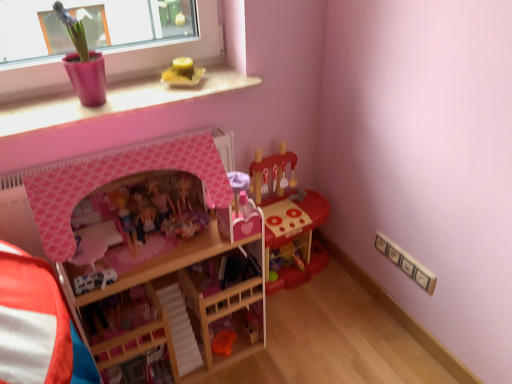
What do you see at coordinates (83, 63) in the screenshot?
I see `matte pink pot at upper left, the 1th toy in the left-to-right sequence` at bounding box center [83, 63].

This screenshot has height=384, width=512. I want to click on matte plastic play kitchen at center, which is the 1th toy from right to left, so tap(288, 219).

What is the approximate height of matte plastic play kitchen at center, which is the 1th toy from right to left?

matte plastic play kitchen at center, which is the 1th toy from right to left, is 24.77 inches in height.

What do you see at coordinates (161, 210) in the screenshot? This screenshot has height=384, width=512. I see `pink matte dollhouse at center, which is the 3th toy in left-to-right order` at bounding box center [161, 210].

The height and width of the screenshot is (384, 512). I want to click on white plastic car at center, the 2th toy in the left-to-right sequence, so click(x=94, y=280).

Measure the distance between point (48, 118) and camera.

The depth of point (48, 118) is 1.34 meters.

Where is `pink plastic window sill at upper left`? pink plastic window sill at upper left is located at coordinates (115, 101).

Where is `matte pink pot at upper left, the 1th toy in the left-to-right sequence`? matte pink pot at upper left, the 1th toy in the left-to-right sequence is located at coordinates (83, 63).

From the image's perspective, which object appears higher, pink matte dollhouse at center, which is the 3th toy from right to left, or white plastic car at center, the fourth toy positioned from the right?

From the image's view, pink matte dollhouse at center, which is the 3th toy from right to left, is above.

Is pink matte dollhouse at center, which is the 3th toy in left-to-right order, far from white plastic car at center, the fourth toy positioned from the right?

No, pink matte dollhouse at center, which is the 3th toy in left-to-right order, is not far from white plastic car at center, the fourth toy positioned from the right.

From a real-world perspective, is pink matte dollhouse at center, which is the 3th toy in left-to-right order, physically above white plastic car at center, the fourth toy positioned from the right?

Correct, in the physical world, pink matte dollhouse at center, which is the 3th toy in left-to-right order, is higher than white plastic car at center, the fourth toy positioned from the right.

Does pink matte dollhouse at center, which is the 3th toy in left-to-right order, come behind matte plastic play kitchen at center, which is the 1th toy from right to left?

No, it is in front of matte plastic play kitchen at center, which is the 1th toy from right to left.

Could you tell me if pink matte dollhouse at center, which is the 3th toy in left-to-right order, is turned towards matte plastic play kitchen at center, marked as the 5th toy in a left-to-right arrangement?

No, pink matte dollhouse at center, which is the 3th toy in left-to-right order, is not facing towards matte plastic play kitchen at center, marked as the 5th toy in a left-to-right arrangement.

How distant is white plastic car at center, the 2th toy in the left-to-right sequence, from yellow wax candle at upper center, the fourth toy from the left?

white plastic car at center, the 2th toy in the left-to-right sequence, is 29.58 inches away from yellow wax candle at upper center, the fourth toy from the left.

Is white plastic car at center, the 2th toy in the left-to-right sequence, in contact with yellow wax candle at upper center, positioned as the 2th toy in right-to-left order?

No, white plastic car at center, the 2th toy in the left-to-right sequence, is not next to yellow wax candle at upper center, positioned as the 2th toy in right-to-left order.

Based on the photo, is yellow wax candle at upper center, positioned as the 2th toy in right-to-left order, located within white plastic car at center, the fourth toy positioned from the right?

Definitely not — yellow wax candle at upper center, positioned as the 2th toy in right-to-left order, is not inside white plastic car at center, the fourth toy positioned from the right.

Which object is positioned more to the right, white plastic car at center, the 2th toy in the left-to-right sequence, or yellow wax candle at upper center, the fourth toy from the left?

yellow wax candle at upper center, the fourth toy from the left.

Considering the relative sizes of yellow wax candle at upper center, positioned as the 2th toy in right-to-left order, and wooden bunk bed at center in the image provided, is yellow wax candle at upper center, positioned as the 2th toy in right-to-left order, taller than wooden bunk bed at center?

No, yellow wax candle at upper center, positioned as the 2th toy in right-to-left order, is not taller than wooden bunk bed at center.

Locate an element on the screen. This screenshot has width=512, height=384. bunk bed that appears below the yellow wax candle at upper center, the fourth toy from the left (from the image's perspective) is located at coordinates coord(117,179).

Is point (174, 76) in front of point (77, 319)?

No, it is behind (77, 319).

Is yellow wax candle at upper center, positioned as the 2th toy in right-to-left order, in contact with wooden bunk bed at center?

No, yellow wax candle at upper center, positioned as the 2th toy in right-to-left order, is not in contact with wooden bunk bed at center.

Is wooden bunk bed at center oriented away from white plastic car at center, the 2th toy in the left-to-right sequence?

Yes.

From the image's perspective, between wooden bunk bed at center and white plastic car at center, the 2th toy in the left-to-right sequence, which one is located above?

white plastic car at center, the 2th toy in the left-to-right sequence, appears higher in the image.

Which is more to the left, wooden bunk bed at center or white plastic car at center, the fourth toy positioned from the right?

white plastic car at center, the fourth toy positioned from the right, is more to the left.

Based on the photo, would you say wooden bunk bed at center is a long distance from white plastic car at center, the fourth toy positioned from the right?

Actually, wooden bunk bed at center and white plastic car at center, the fourth toy positioned from the right, are a little close together.

Between matte pink pot at upper left, the 1th toy in the left-to-right sequence, and yellow wax candle at upper center, positioned as the 2th toy in right-to-left order, which one appears on the left side from the viewer's perspective?

matte pink pot at upper left, the 1th toy in the left-to-right sequence.

Is point (85, 63) closer or farther from the camera than point (174, 59)?

Point (85, 63).

Considering the sizes of objects matte pink pot at upper left, arranged as the 5th toy when viewed from the right, and yellow wax candle at upper center, positioned as the 2th toy in right-to-left order, in the image provided, who is bigger, matte pink pot at upper left, arranged as the 5th toy when viewed from the right, or yellow wax candle at upper center, positioned as the 2th toy in right-to-left order,?

matte pink pot at upper left, arranged as the 5th toy when viewed from the right, is bigger.

Is yellow wax candle at upper center, positioned as the 2th toy in right-to-left order, located within matte pink pot at upper left, the 1th toy in the left-to-right sequence?

That's incorrect, yellow wax candle at upper center, positioned as the 2th toy in right-to-left order, is not inside matte pink pot at upper left, the 1th toy in the left-to-right sequence.

What's the angular difference between pink plastic window sill at upper left and matte pink pot at upper left, arranged as the 5th toy when viewed from the right,'s facing directions?

The angle between the facing direction of pink plastic window sill at upper left and the facing direction of matte pink pot at upper left, arranged as the 5th toy when viewed from the right, is 1.9 degrees.

Does pink plastic window sill at upper left have a larger size compared to matte pink pot at upper left, arranged as the 5th toy when viewed from the right?

Actually, pink plastic window sill at upper left might be smaller than matte pink pot at upper left, arranged as the 5th toy when viewed from the right.

From a real-world perspective, is pink plastic window sill at upper left positioned above or below matte pink pot at upper left, the 1th toy in the left-to-right sequence?

pink plastic window sill at upper left is below matte pink pot at upper left, the 1th toy in the left-to-right sequence.

At what (x,y) coordinates should I click in order to perform the action: click on toy that is the 2nd object located above the pink plastic window sill at upper left (from the image's perspective). Please return your answer as a coordinate pair (x, y). The image size is (512, 384). Looking at the image, I should click on (83, 63).

You are a GUI agent. You are given a task and a screenshot of the screen. Output one action in this format:
    pyautogui.click(x=<x>, y=<y>)
    Task: Click on the 1st toy located above the white plastic car at center, the 2th toy in the left-to-right sequence (from a real-world perspective)
    The height and width of the screenshot is (384, 512).
    Given the screenshot: What is the action you would take?
    pyautogui.click(x=161, y=210)

Starting from the pink matte dollhouse at center, which is the 3th toy in left-to-right order, which toy is the 2nd one behind? Please provide its 2D coordinates.

[(288, 219)]

Based on their spatial positions, is matte pink pot at upper left, arranged as the 5th toy when viewed from the right, or pink plastic window sill at upper left further from matte plastic play kitchen at center, which is the 1th toy from right to left?

matte pink pot at upper left, arranged as the 5th toy when viewed from the right, is further to matte plastic play kitchen at center, which is the 1th toy from right to left.

When comparing their distances from matte pink pot at upper left, the 1th toy in the left-to-right sequence, does matte plastic play kitchen at center, marked as the 5th toy in a left-to-right arrangement, or pink plastic window sill at upper left seem further?

Based on the image, matte plastic play kitchen at center, marked as the 5th toy in a left-to-right arrangement, appears to be further to matte pink pot at upper left, the 1th toy in the left-to-right sequence.

When comparing their distances from yellow wax candle at upper center, the fourth toy from the left, does pink matte dollhouse at center, which is the 3th toy in left-to-right order, or wooden bunk bed at center seem further?

wooden bunk bed at center is positioned further to the anchor yellow wax candle at upper center, the fourth toy from the left.

Looking at the image, which one is located further to pink plastic window sill at upper left, matte plastic play kitchen at center, marked as the 5th toy in a left-to-right arrangement, or wooden bunk bed at center?

matte plastic play kitchen at center, marked as the 5th toy in a left-to-right arrangement.

Looking at the image, which one is located further to yellow wax candle at upper center, positioned as the 2th toy in right-to-left order, pink matte dollhouse at center, which is the 3th toy from right to left, or pink plastic window sill at upper left?

pink matte dollhouse at center, which is the 3th toy from right to left, is further to yellow wax candle at upper center, positioned as the 2th toy in right-to-left order.

From the image, which object appears to be nearer to yellow wax candle at upper center, positioned as the 2th toy in right-to-left order, pink plastic window sill at upper left or matte plastic play kitchen at center, marked as the 5th toy in a left-to-right arrangement?

The object closer to yellow wax candle at upper center, positioned as the 2th toy in right-to-left order, is pink plastic window sill at upper left.

Considering their positions, is yellow wax candle at upper center, positioned as the 2th toy in right-to-left order, positioned further to pink plastic window sill at upper left than pink matte dollhouse at center, which is the 3th toy in left-to-right order?

Based on the image, pink matte dollhouse at center, which is the 3th toy in left-to-right order, appears to be further to pink plastic window sill at upper left.

Based on the photo, estimate the real-world distances between objects in this image. Which object is further from pink plastic window sill at upper left, matte plastic play kitchen at center, which is the 1th toy from right to left, or white plastic car at center, the fourth toy positioned from the right?

white plastic car at center, the fourth toy positioned from the right, is positioned further to the anchor pink plastic window sill at upper left.

I want to click on window sill situated between white plastic car at center, the fourth toy positioned from the right, and matte plastic play kitchen at center, marked as the 5th toy in a left-to-right arrangement, from left to right, so tap(115, 101).

Where is `window sill between matte pink pot at upper left, arranged as the 5th toy when viewed from the right, and white plastic car at center, the fourth toy positioned from the right, from top to bottom`? This screenshot has height=384, width=512. window sill between matte pink pot at upper left, arranged as the 5th toy when viewed from the right, and white plastic car at center, the fourth toy positioned from the right, from top to bottom is located at coordinates (115, 101).

This screenshot has width=512, height=384. What are the coordinates of `toy between yellow wax candle at upper center, the fourth toy from the left, and matte plastic play kitchen at center, marked as the 5th toy in a left-to-right arrangement, vertically` in the screenshot? It's located at (161, 210).

You are a GUI agent. You are given a task and a screenshot of the screen. Output one action in this format:
    pyautogui.click(x=<x>, y=<y>)
    Task: Click on the window sill between yellow wax candle at upper center, positioned as the 2th toy in right-to-left order, and wooden bunk bed at center from top to bottom
    The height and width of the screenshot is (384, 512).
    Given the screenshot: What is the action you would take?
    pyautogui.click(x=115, y=101)